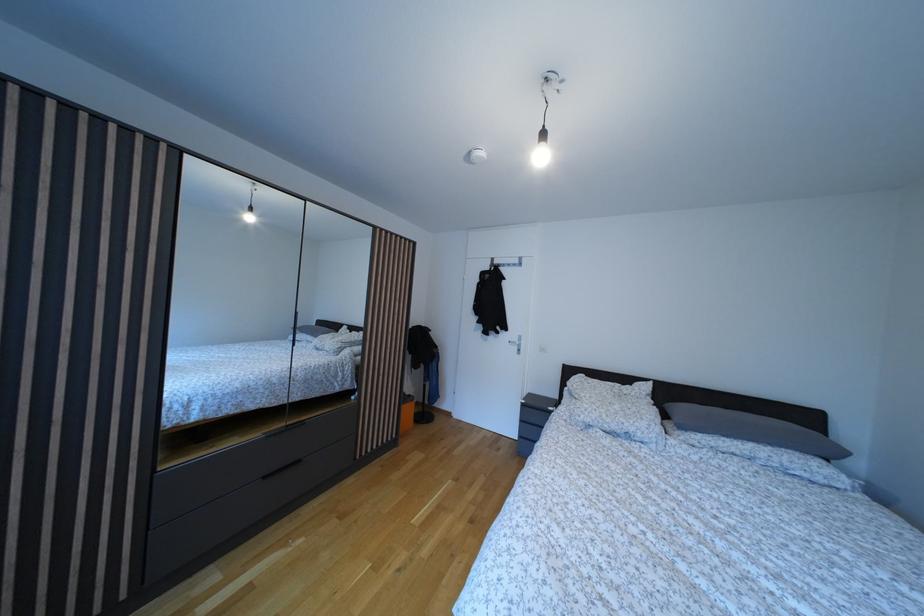
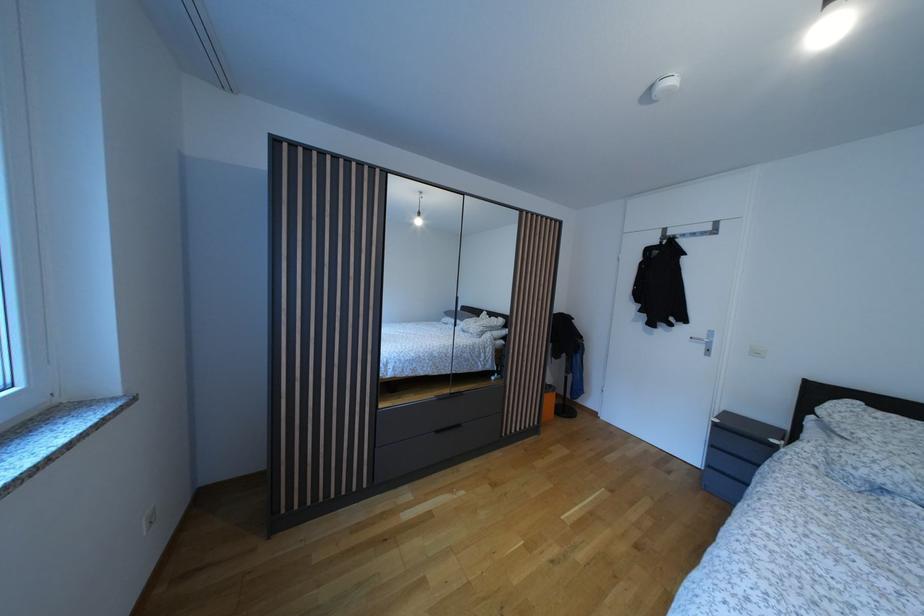
Question: The first image is from the beginning of the video and the second image is from the end. How did the camera likely rotate when shooting the video?

Choices:
 (A) Left
 (B) Right
 (C) Up
 (D) Down

Answer: (A)